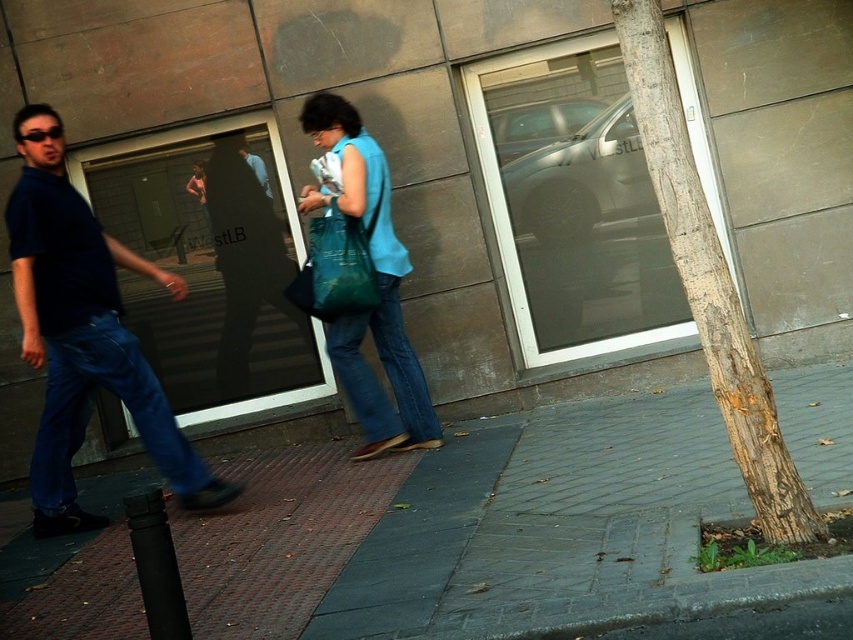
Is smooth concrete sidewalk at center shorter than brown textured bark at right?

Correct, smooth concrete sidewalk at center is not as tall as brown textured bark at right.

Can you confirm if smooth concrete sidewalk at center is positioned below brown textured bark at right?

Yes.

Which is in front, point (807, 412) or point (761, 461)?

Point (761, 461) is in front.

Locate an element on the screen. This screenshot has height=640, width=853. smooth concrete sidewalk at center is located at coordinates (482, 531).

Does matte blue fabric bag at center have a greater width compared to matte blue jeans at center?

Incorrect, matte blue fabric bag at center's width does not surpass matte blue jeans at center's.

Is matte blue fabric bag at center to the right of matte blue jeans at center from the viewer's perspective?

Correct, you'll find matte blue fabric bag at center to the right of matte blue jeans at center.

What do you see at coordinates (376, 285) in the screenshot? The height and width of the screenshot is (640, 853). I see `matte blue fabric bag at center` at bounding box center [376, 285].

This screenshot has width=853, height=640. What are the coordinates of `matte blue fabric bag at center` in the screenshot? It's located at 376,285.

Does dark blue jeans at left appear over matte green fabric bag at center?

No, dark blue jeans at left is not above matte green fabric bag at center.

Between point (83, 307) and point (315, 276), which one is positioned behind?

Point (315, 276)

From the picture: Who is more forward, (224, 486) or (312, 276)?

Point (224, 486) is in front.

The width and height of the screenshot is (853, 640). I want to click on dark blue jeans at left, so click(x=83, y=333).